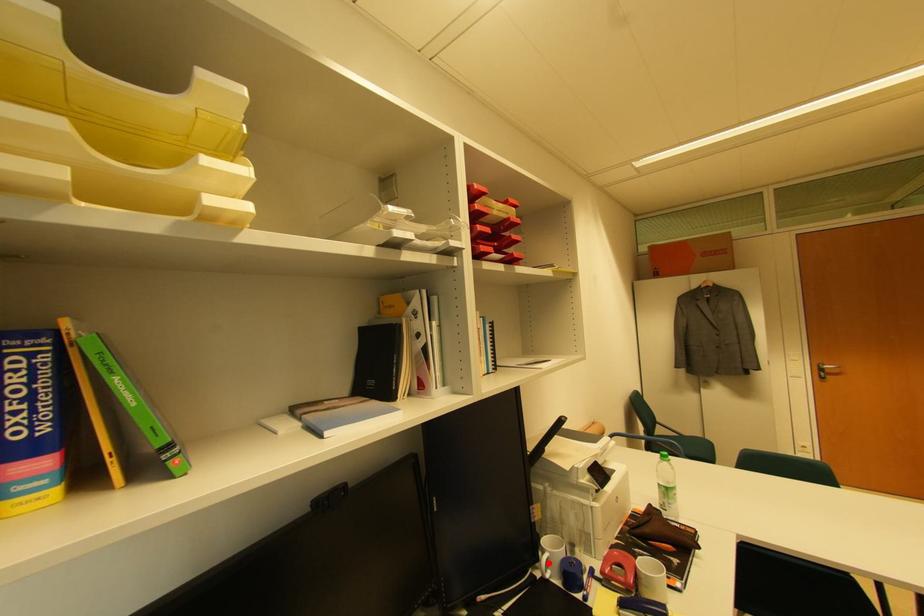
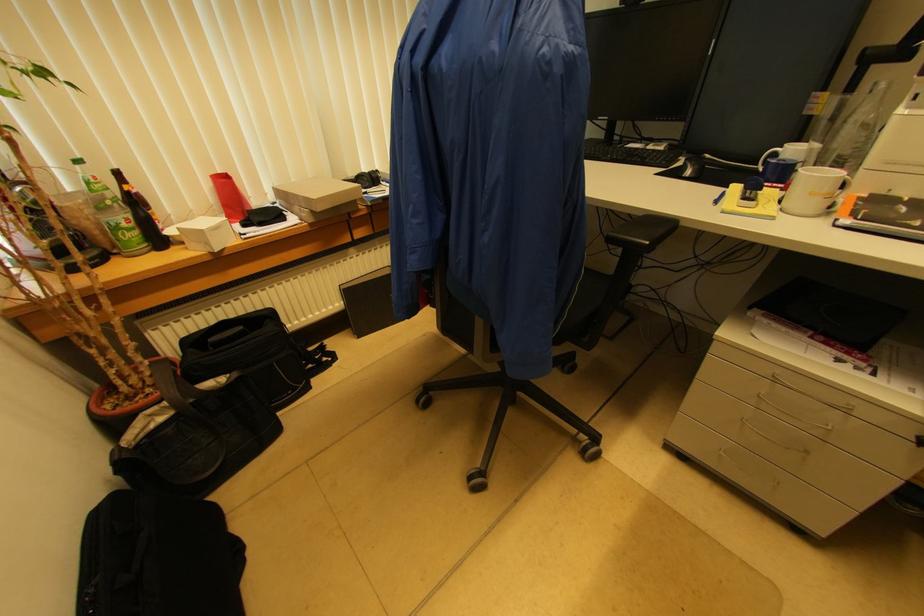
Find the pixel in the second image that matches the highlighted location in the first image.

(775, 156)